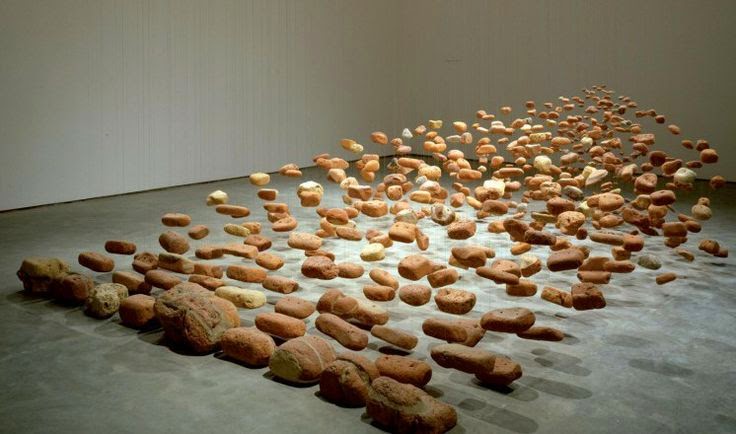
This screenshot has height=434, width=736. Find the location of `right wall background`. right wall background is located at coordinates (629, 68).